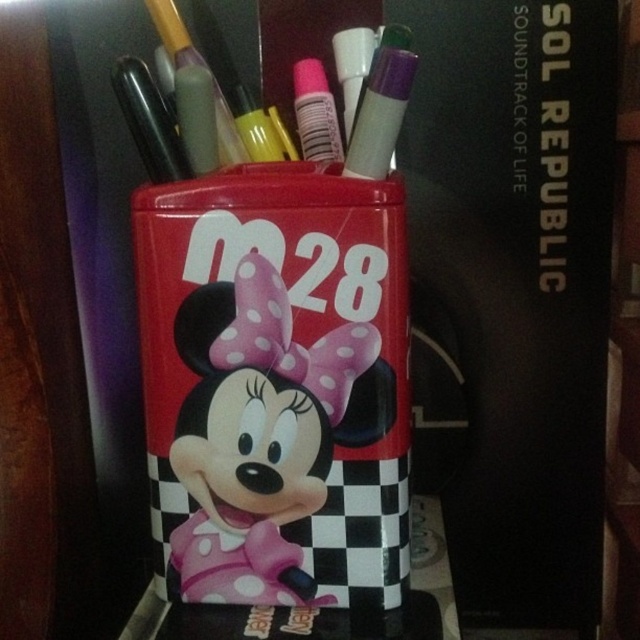
Does point (177, 458) come closer to viewer compared to point (145, 163)?

Yes, it is in front of point (145, 163).

I want to click on matte plastic minnie mouse at center, so click(x=256, y=436).

Between matte plastic minnie mouse at center and matte purple marker at center, which one has more height?

matte plastic minnie mouse at center is taller.

Which is in front, point (326, 362) or point (385, 72)?

Positioned in front is point (385, 72).

Is point (298, 512) farther from camera compared to point (388, 148)?

Yes, point (298, 512) is farther from viewer.

The width and height of the screenshot is (640, 640). I want to click on matte plastic minnie mouse at center, so click(256, 436).

Between point (369, 120) and point (356, 97), which one is positioned in front?

Point (369, 120) is in front.

Can you confirm if matte purple marker at center is shorter than white matte marker at upper center?

Correct, matte purple marker at center is not as tall as white matte marker at upper center.

Where is `matte purple marker at center`? The image size is (640, 640). matte purple marker at center is located at coordinates (380, 113).